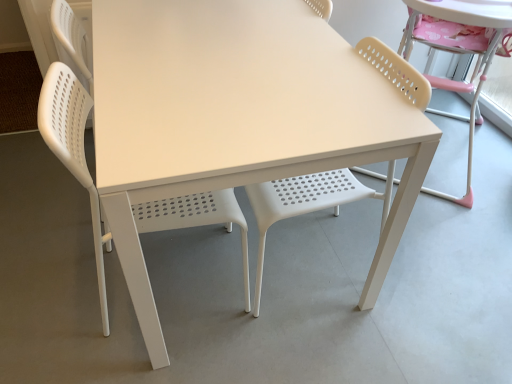
At what (x,y) coordinates should I click in order to perform the action: click on free location in front of matte white chair at center, placed as the second chair when sorted from right to left. Please return your answer as a coordinate pair (x, y). This screenshot has height=384, width=512. Looking at the image, I should click on (309, 344).